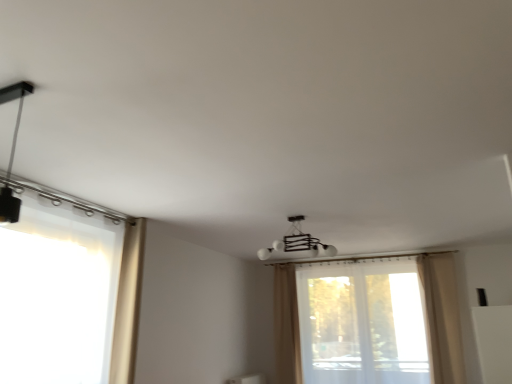
Identify the location of beige fabric curtain at left, the 1th curtain in the front-to-back sequence. (128, 303).

What do you see at coordinates (441, 317) in the screenshot?
I see `beige fabric curtain at right, marked as the third curtain in a left-to-right arrangement` at bounding box center [441, 317].

I want to click on beige fabric curtain at left, which appears as the 3th curtain when viewed from the back, so click(x=128, y=303).

Considering their positions, is translucent fabric window at left, placed as the 1th window when sorted from front to back, located in front of or behind white glossy chandelier at center, positioned as the 2th lamp in left-to-right order?

translucent fabric window at left, placed as the 1th window when sorted from front to back, is positioned closer to the viewer than white glossy chandelier at center, positioned as the 2th lamp in left-to-right order.

Does translucent fabric window at left, placed as the 1th window when sorted from left to right, have a larger size compared to white glossy chandelier at center, positioned as the 2th lamp in left-to-right order?

Yes, translucent fabric window at left, placed as the 1th window when sorted from left to right, is bigger than white glossy chandelier at center, positioned as the 2th lamp in left-to-right order.

Can you confirm if translucent fabric window at left, placed as the 1th window when sorted from left to right, is positioned to the left of white glossy chandelier at center, the 1th lamp in the back-to-front sequence?

Correct, you'll find translucent fabric window at left, placed as the 1th window when sorted from left to right, to the left of white glossy chandelier at center, the 1th lamp in the back-to-front sequence.

Is translucent fabric window at left, placed as the 1th window when sorted from left to right, not near beige fabric curtain at center, which is the 2th curtain from right to left?

Yes, translucent fabric window at left, placed as the 1th window when sorted from left to right, and beige fabric curtain at center, which is the 2th curtain from right to left, are located far from each other.

Which object is further away from the camera taking this photo, translucent fabric window at left, placed as the 1th window when sorted from left to right, or beige fabric curtain at center, which is the 1th curtain from back to front?

beige fabric curtain at center, which is the 1th curtain from back to front.

Is translucent fabric window at left, placed as the 1th window when sorted from left to right, inside or outside of beige fabric curtain at center, the third curtain when ordered from front to back?

translucent fabric window at left, placed as the 1th window when sorted from left to right, is not enclosed by beige fabric curtain at center, the third curtain when ordered from front to back.

Is translucent fabric window at left, placed as the 1th window when sorted from left to right, smaller than beige fabric curtain at center, positioned as the 2th curtain in left-to-right order?

No, translucent fabric window at left, placed as the 1th window when sorted from left to right, is not smaller than beige fabric curtain at center, positioned as the 2th curtain in left-to-right order.

From the image's perspective, relative to transparent fabric window at center, which appears as the 2th window when viewed from the left, is beige fabric curtain at center, which is the 1th curtain from back to front, above or below?

From the image's perspective, beige fabric curtain at center, which is the 1th curtain from back to front, appears below transparent fabric window at center, which appears as the 2th window when viewed from the left.

Is beige fabric curtain at center, which is the 2th curtain from right to left, facing towards transparent fabric window at center, positioned as the 1th window in back-to-front order?

No, beige fabric curtain at center, which is the 2th curtain from right to left, is not oriented towards transparent fabric window at center, positioned as the 1th window in back-to-front order.

Does beige fabric curtain at center, which is the 2th curtain from right to left, have a smaller size compared to transparent fabric window at center, which appears as the 2th window when viewed from the left?

Yes, beige fabric curtain at center, which is the 2th curtain from right to left, is smaller than transparent fabric window at center, which appears as the 2th window when viewed from the left.

Does matte black track light at upper left, positioned as the 2th lamp in right-to-left order, have a larger size compared to beige fabric curtain at center, which is the 2th curtain from right to left?

Actually, matte black track light at upper left, positioned as the 2th lamp in right-to-left order, might be smaller than beige fabric curtain at center, which is the 2th curtain from right to left.

Between matte black track light at upper left, which is counted as the 2th lamp, starting from the bottom, and beige fabric curtain at center, which is the 1th curtain from back to front, which one appears on the right side from the viewer's perspective?

beige fabric curtain at center, which is the 1th curtain from back to front, is more to the right.

Which object is further away from the camera, matte black track light at upper left, which is counted as the 2th lamp, starting from the bottom, or beige fabric curtain at center, which is the 2th curtain from right to left?

beige fabric curtain at center, which is the 2th curtain from right to left, is further from the camera.

From a real-world perspective, is matte black track light at upper left, which appears as the first lamp when viewed from the left, on top of beige fabric curtain at center, which is the 1th curtain from back to front?

Correct, in the physical world, matte black track light at upper left, which appears as the first lamp when viewed from the left, is higher than beige fabric curtain at center, which is the 1th curtain from back to front.

Is matte black track light at upper left, positioned as the 2th lamp in right-to-left order, turned away from white glossy chandelier at center, the 1th lamp in the back-to-front sequence?

No.

From a real-world perspective, is matte black track light at upper left, which is the first lamp from top to bottom, above or below white glossy chandelier at center, which is the 1th lamp in bottom-to-top order?

matte black track light at upper left, which is the first lamp from top to bottom, is below white glossy chandelier at center, which is the 1th lamp in bottom-to-top order.

Does matte black track light at upper left, which appears as the first lamp when viewed from the left, have a greater width compared to white glossy chandelier at center, positioned as the 2th lamp in left-to-right order?

Incorrect, the width of matte black track light at upper left, which appears as the first lamp when viewed from the left, does not surpass that of white glossy chandelier at center, positioned as the 2th lamp in left-to-right order.

From the picture: Is matte black track light at upper left, which appears as the first lamp when viewed from the left, oriented towards beige fabric curtain at left, which is the third curtain in right-to-left order?

No, matte black track light at upper left, which appears as the first lamp when viewed from the left, is not facing towards beige fabric curtain at left, which is the third curtain in right-to-left order.

Between matte black track light at upper left, which is the first lamp from top to bottom, and beige fabric curtain at left, the 1th curtain in the front-to-back sequence, which one has smaller size?

matte black track light at upper left, which is the first lamp from top to bottom, is smaller.

From a real-world perspective, does matte black track light at upper left, which is counted as the 2th lamp, starting from the bottom, stand above beige fabric curtain at left, which appears as the 3th curtain when viewed from the back?

Yes, from a real-world perspective, matte black track light at upper left, which is counted as the 2th lamp, starting from the bottom, is over beige fabric curtain at left, which appears as the 3th curtain when viewed from the back

Who is more distant, matte black track light at upper left, which is the first lamp in front-to-back order, or beige fabric curtain at left, the 1th curtain in the front-to-back sequence?

beige fabric curtain at left, the 1th curtain in the front-to-back sequence, is behind.

Looking at the image, does beige fabric curtain at left, which appears as the 3th curtain when viewed from the back, seem bigger or smaller compared to translucent fabric window at left, placed as the 1th window when sorted from left to right?

Considering their sizes, beige fabric curtain at left, which appears as the 3th curtain when viewed from the back, takes up less space than translucent fabric window at left, placed as the 1th window when sorted from left to right.

Is beige fabric curtain at left, which appears as the first curtain when viewed from the left, directly adjacent to translucent fabric window at left, placed as the second window when sorted from right to left?

beige fabric curtain at left, which appears as the first curtain when viewed from the left, is not next to translucent fabric window at left, placed as the second window when sorted from right to left, and they're not touching.

Can you tell me how much beige fabric curtain at left, which appears as the 3th curtain when viewed from the back, and translucent fabric window at left, placed as the second window when sorted from right to left, differ in facing direction?

The angle between the facing direction of beige fabric curtain at left, which appears as the 3th curtain when viewed from the back, and the facing direction of translucent fabric window at left, placed as the second window when sorted from right to left, is 1.39e-05 degrees.

Which is nearer, (125, 253) or (61, 353)?

The point (61, 353) is in front.

At what (x,y) coordinates should I click in order to perform the action: click on lamp that appears behind the translucent fabric window at left, placed as the 2th window when sorted from back to front. Please return your answer as a coordinate pair (x, y). Image resolution: width=512 pixels, height=384 pixels. Looking at the image, I should click on (298, 242).

Find the location of a particular element. window to the left of beige fabric curtain at center, which is the 1th curtain from back to front is located at coordinates (58, 295).

Looking at the image, which one is located closer to transparent fabric window at center, which is the 2th window from front to back, white glossy chandelier at center, the 1th lamp in the back-to-front sequence, or beige fabric curtain at right, the 2th curtain in the back-to-front sequence?

beige fabric curtain at right, the 2th curtain in the back-to-front sequence.

Considering their positions, is beige fabric curtain at center, positioned as the 2th curtain in left-to-right order, positioned closer to beige fabric curtain at left, which appears as the first curtain when viewed from the left, than translucent fabric window at left, placed as the 2th window when sorted from back to front?

translucent fabric window at left, placed as the 2th window when sorted from back to front, lies closer to beige fabric curtain at left, which appears as the first curtain when viewed from the left, than the other object.

Consider the image. Which object lies nearer to the anchor point white glossy chandelier at center, which is the 1th lamp in bottom-to-top order, beige fabric curtain at right, placed as the 2th curtain when sorted from front to back, or transparent fabric window at center, which is the 2th window from front to back?

The object closer to white glossy chandelier at center, which is the 1th lamp in bottom-to-top order, is beige fabric curtain at right, placed as the 2th curtain when sorted from front to back.

Considering their positions, is transparent fabric window at center, which appears as the 2th window when viewed from the left, positioned closer to translucent fabric window at left, placed as the second window when sorted from right to left, than beige fabric curtain at right, the 2th curtain in the back-to-front sequence?

beige fabric curtain at right, the 2th curtain in the back-to-front sequence.

Considering their positions, is beige fabric curtain at right, positioned as the 1th curtain in right-to-left order, positioned further to white glossy chandelier at center, which is the 1th lamp in bottom-to-top order, than beige fabric curtain at center, positioned as the 2th curtain in left-to-right order?

Based on the image, beige fabric curtain at right, positioned as the 1th curtain in right-to-left order, appears to be further to white glossy chandelier at center, which is the 1th lamp in bottom-to-top order.

When comparing their distances from beige fabric curtain at right, the 2th curtain in the back-to-front sequence, does beige fabric curtain at left, the 1th curtain in the front-to-back sequence, or white glossy chandelier at center, positioned as the 2th lamp in left-to-right order, seem closer?

white glossy chandelier at center, positioned as the 2th lamp in left-to-right order, is positioned closer to the anchor beige fabric curtain at right, the 2th curtain in the back-to-front sequence.

Estimate the real-world distances between objects in this image. Which object is further from beige fabric curtain at right, the 2th curtain in the back-to-front sequence, translucent fabric window at left, placed as the 2th window when sorted from back to front, or white glossy chandelier at center, which is counted as the first lamp, starting from the right?

translucent fabric window at left, placed as the 2th window when sorted from back to front, is further to beige fabric curtain at right, the 2th curtain in the back-to-front sequence.

Estimate the real-world distances between objects in this image. Which object is further from translucent fabric window at left, placed as the 2th window when sorted from back to front, beige fabric curtain at left, which appears as the 3th curtain when viewed from the back, or matte black track light at upper left, which is the first lamp from top to bottom?

matte black track light at upper left, which is the first lamp from top to bottom.

I want to click on window between matte black track light at upper left, which is counted as the 2th lamp, starting from the bottom, and white glossy chandelier at center, the 1th lamp in the back-to-front sequence, along the z-axis, so click(x=58, y=295).

The width and height of the screenshot is (512, 384). I want to click on curtain between matte black track light at upper left, which is counted as the 2th lamp, starting from the bottom, and white glossy chandelier at center, positioned as the 2th lamp in left-to-right order, from front to back, so click(128, 303).

The height and width of the screenshot is (384, 512). Find the location of `lamp between matte black track light at upper left, which is the first lamp from top to bottom, and beige fabric curtain at center, the third curtain when ordered from front to back, from front to back`. lamp between matte black track light at upper left, which is the first lamp from top to bottom, and beige fabric curtain at center, the third curtain when ordered from front to back, from front to back is located at coordinates (298, 242).

Identify the location of window between matte black track light at upper left, which is the first lamp from top to bottom, and beige fabric curtain at left, which is the third curtain in right-to-left order, from front to back. The image size is (512, 384). (58, 295).